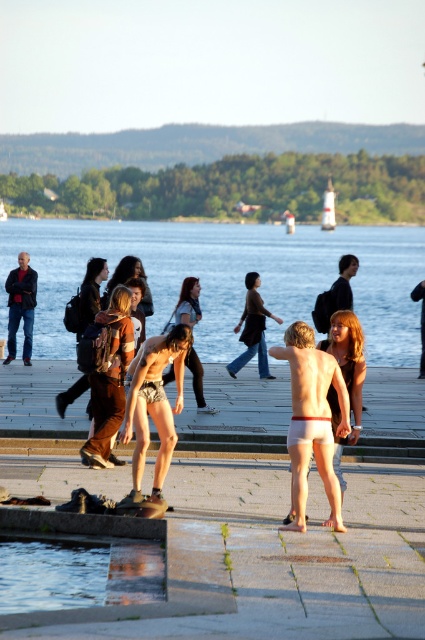
What is the 2D coordinate of the clear blue water at center?

The clear blue water at center is located at the 2D coordinate point of (226, 276).

You are standing on the waterfront promenade and see the matte black shirt at center and the white fabric shorts at center. Which one is closer to you?

The matte black shirt at center is closer to you because the white fabric shorts at center is behind it.